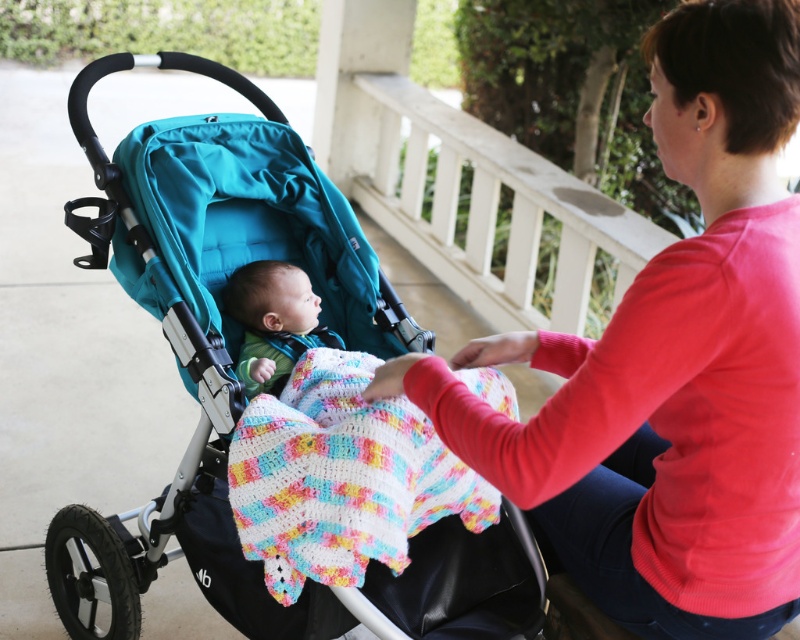
Based on the photo, which of these two, matte red sweater at center or soft green knit sweater at center, stands shorter?

With less height is soft green knit sweater at center.

This screenshot has width=800, height=640. What are the coordinates of `matte red sweater at center` in the screenshot? It's located at (672, 365).

Who is positioned more to the right, matte red sweater at center or multicolored crocheted blanket at center?

matte red sweater at center

Does matte red sweater at center appear on the left side of multicolored crocheted blanket at center?

In fact, matte red sweater at center is to the right of multicolored crocheted blanket at center.

The image size is (800, 640). What do you see at coordinates (672, 365) in the screenshot? I see `matte red sweater at center` at bounding box center [672, 365].

Image resolution: width=800 pixels, height=640 pixels. I want to click on matte red sweater at center, so click(x=672, y=365).

Is point (92, 129) farther from viewer compared to point (418, 451)?

Yes, it is.

Describe the element at coordinates (196, 328) in the screenshot. I see `teal fabric stroller at left` at that location.

The width and height of the screenshot is (800, 640). I want to click on teal fabric stroller at left, so click(x=196, y=328).